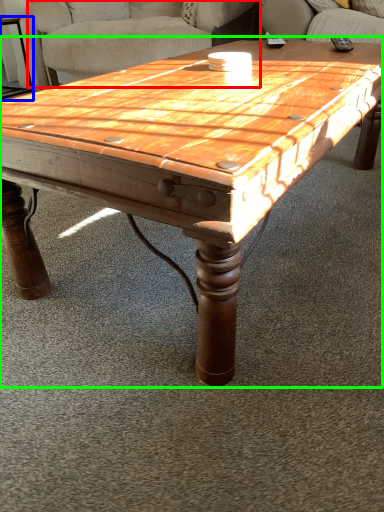
Question: Which object is the farthest from swivel chair (highlighted by a red box)? Choose among these: side table (highlighted by a blue box) or coffee table (highlighted by a green box).

Choices:
 (A) side table
 (B) coffee table

Answer: (B)